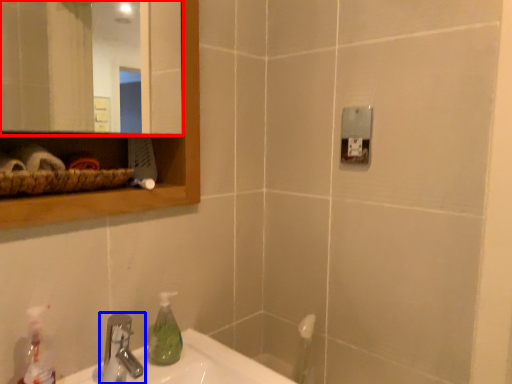
Question: Among these objects, which one is nearest to the camera, mirror (highlighted by a red box) or tap (highlighted by a blue box)?

Choices:
 (A) mirror
 (B) tap

Answer: (A)